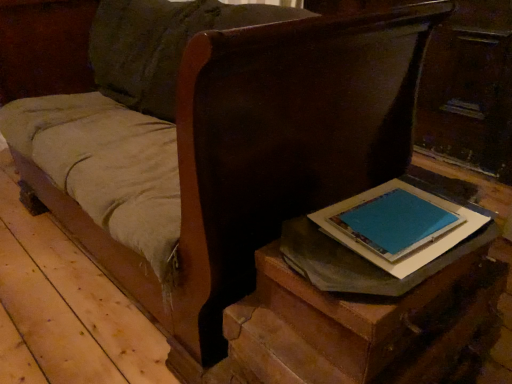
You are a GUI agent. You are given a task and a screenshot of the screen. Output one action in this format:
    pyautogui.click(x=<x>, y=<y>)
    Task: Click on the vacant space situated above blue paper at right (from a real-world perspective)
    
    Given the screenshot: What is the action you would take?
    pyautogui.click(x=401, y=213)